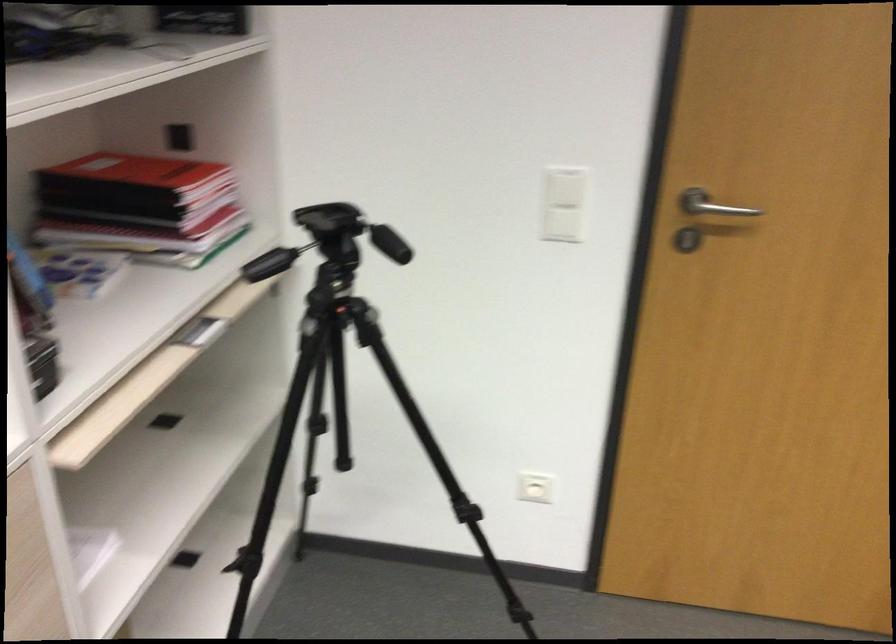
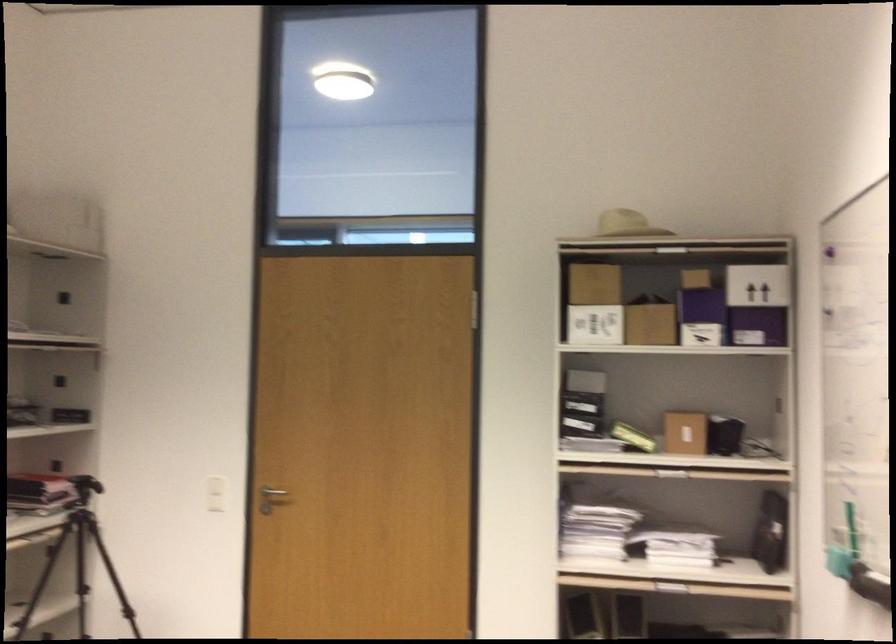
Which direction would the cameraman need to move to produce the second image?

The movement direction of the cameraman is right, backward.